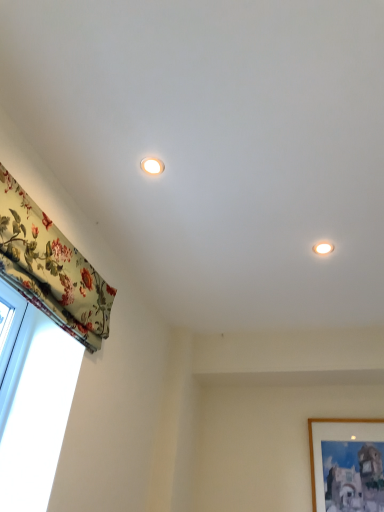
Question: Considering the positions of matte white light fixture at upper center, the 1th lighting viewed from the top, and wooden picture frame at lower right in the image, is matte white light fixture at upper center, the 1th lighting viewed from the top, taller or shorter than wooden picture frame at lower right?

Choices:
 (A) tall
 (B) short

Answer: (B)

Question: Do you think matte white light fixture at upper center, marked as the 2th lighting in a back-to-front arrangement, is within wooden picture frame at lower right, or outside of it?

Choices:
 (A) inside
 (B) outside

Answer: (B)

Question: Based on their relative distances, which object is farther from the matte white light fixture at upper right, arranged as the 2th lighting when viewed from the top?

Choices:
 (A) matte white light fixture at upper center, the second lighting positioned from the right
 (B) wooden picture frame at lower right
 (C) floral fabric curtain at left

Answer: (B)

Question: Based on their relative distances, which object is nearer to the floral fabric curtain at left?

Choices:
 (A) matte white light fixture at upper right, which ranks as the 2th lighting in front-to-back order
 (B) wooden picture frame at lower right
 (C) matte white light fixture at upper center, the 1th lighting viewed from the front

Answer: (C)